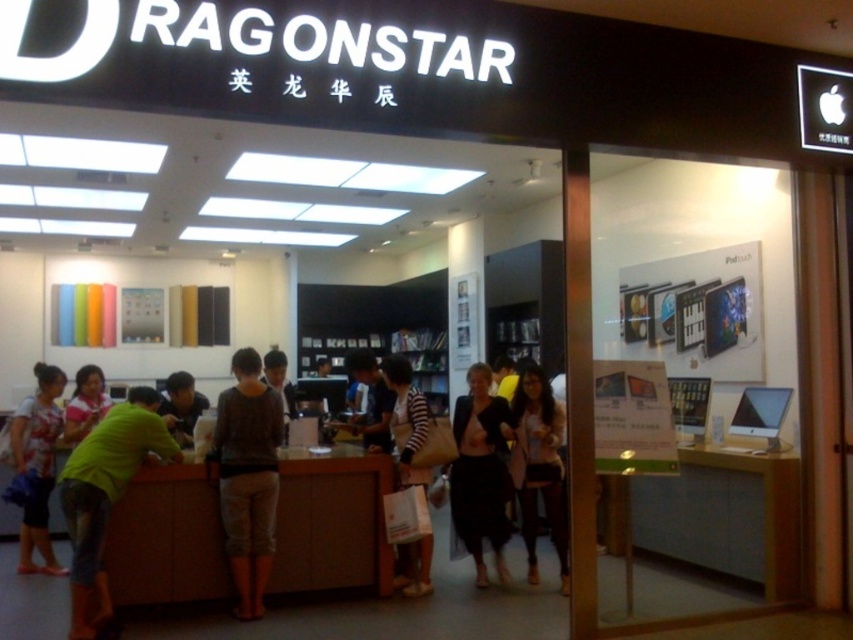
Question: Is white glossy monitor at right wider than striped fabric bag at center?

Choices:
 (A) yes
 (B) no

Answer: (A)

Question: Does dark gray cotton pants at center appear on the right side of light brown leather jacket at center?

Choices:
 (A) no
 (B) yes

Answer: (A)

Question: Can you confirm if white glossy monitor at right is positioned above striped fabric bag at center?

Choices:
 (A) yes
 (B) no

Answer: (B)

Question: Which point is closer to the camera?

Choices:
 (A) green matte shirt at left
 (B) black sheer skirt at center
 (C) striped fabric bag at center

Answer: (A)

Question: Among these objects, which one is farthest from the camera?

Choices:
 (A) light brown leather jacket at center
 (B) green matte shirt at left

Answer: (A)

Question: Which point is farther to the camera?

Choices:
 (A) brown wood desk at center
 (B) black sheer skirt at center

Answer: (B)